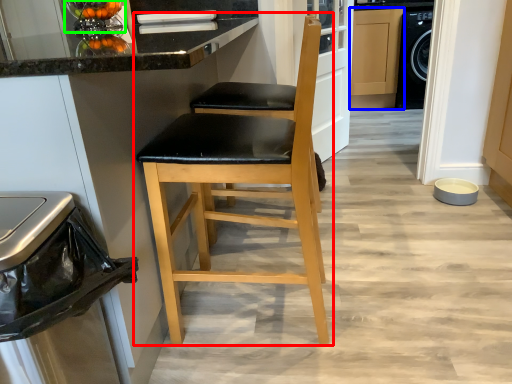
Question: Which object is positioned farthest from chair (highlighted by a red box)? Select from cabinetry (highlighted by a blue box) and appliance (highlighted by a green box).

Choices:
 (A) cabinetry
 (B) appliance

Answer: (A)